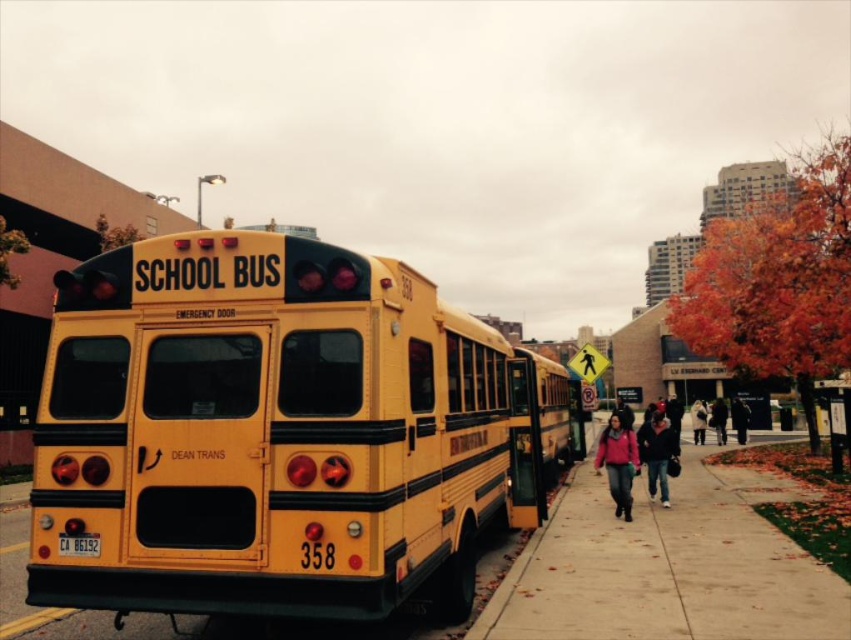
You are standing in front of the yellow school bus with the open rear doors. There are two points marked on the bus body. One is at coordinate point [290,291] and the other at point [703,410]. Which point is closer to your current position?

Point [290,291] is closer to the camera than point [703,410], so the point at coordinates [290,291] is closer to your current position.